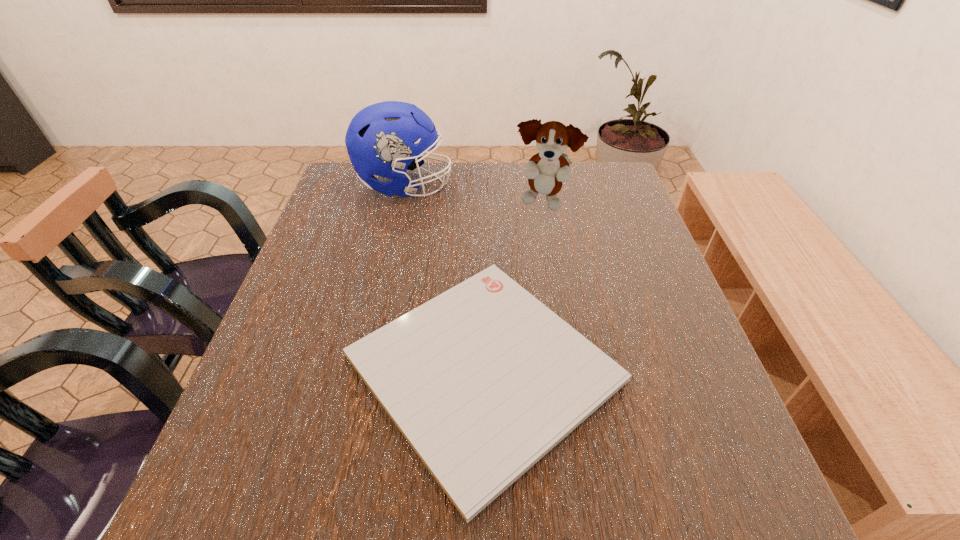
Where is `puppy`? Image resolution: width=960 pixels, height=540 pixels. puppy is located at coordinates (546, 170).

At what (x,y) coordinates should I click in order to perform the action: click on football helmet. Please return your answer as a coordinate pair (x, y). The image size is (960, 540). Looking at the image, I should click on tap(380, 140).

Locate an element on the screen. This screenshot has height=540, width=960. the nearest object is located at coordinates (483, 380).

This screenshot has width=960, height=540. In order to click on the shortest object in this screenshot , I will do `click(483, 380)`.

Locate an element on the screen. vacant space located 0.100m on the face of the puppy is located at coordinates (550, 245).

The image size is (960, 540). I want to click on vacant region located 0.300m on the face guard of the football helmet, so click(x=555, y=185).

You are a GUI agent. You are given a task and a screenshot of the screen. Output one action in this format:
    pyautogui.click(x=<x>, y=<y>)
    Task: Click on the vacant space located 0.120m on the right of the nearest object
    The image size is (960, 540).
    Given the screenshot: What is the action you would take?
    pyautogui.click(x=689, y=368)

This screenshot has width=960, height=540. In order to click on puppy present at the far edge in this screenshot , I will do `click(546, 170)`.

This screenshot has width=960, height=540. In order to click on football helmet situated at the far edge in this screenshot , I will do `click(380, 140)`.

You are a GUI agent. You are given a task and a screenshot of the screen. Output one action in this format:
    pyautogui.click(x=<x>, y=<y>)
    Task: Click on the object at the near edge
    
    Given the screenshot: What is the action you would take?
    pyautogui.click(x=483, y=380)